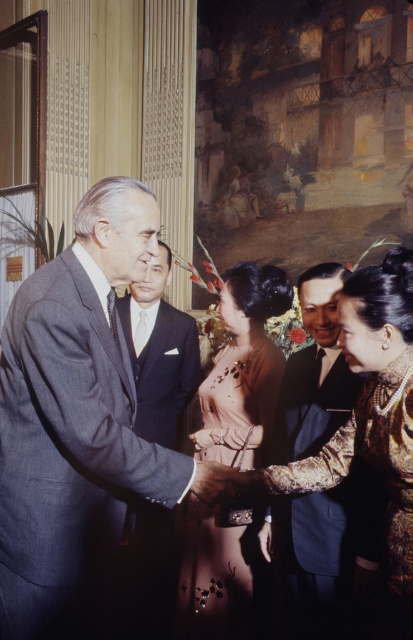
Question: Is matte black suit at center closer to the viewer compared to gold textured suit at center?

Choices:
 (A) yes
 (B) no

Answer: (A)

Question: Is dark gray wool suit at left smaller than matte gold bracelet at lower center?

Choices:
 (A) yes
 (B) no

Answer: (B)

Question: Which point appears closest to the camera in this image?

Choices:
 (A) (256, 360)
 (B) (182, 392)

Answer: (A)

Question: Is dark gray wool suit at left thinner than dark blue suit at center?

Choices:
 (A) no
 (B) yes

Answer: (A)

Question: Which of the following is the farthest from the observer?

Choices:
 (A) dark gray wool suit at left
 (B) matte gold bracelet at lower center

Answer: (B)

Question: Which point appears farthest from the camera in this image?

Choices:
 (A) (209, 531)
 (B) (30, 276)
 (C) (180, 387)

Answer: (C)